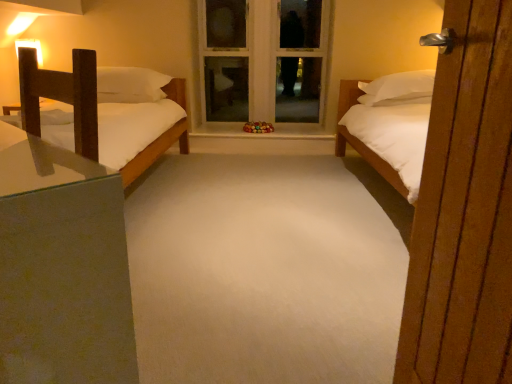
Question: From a real-world perspective, is wooden nightstand at left located beneath white painted wood window frame at center?

Choices:
 (A) no
 (B) yes

Answer: (B)

Question: Is the position of wooden nightstand at left more distant than that of white painted wood window frame at center?

Choices:
 (A) no
 (B) yes

Answer: (A)

Question: From the image's perspective, is wooden nightstand at left located above white painted wood window frame at center?

Choices:
 (A) yes
 (B) no

Answer: (B)

Question: Does wooden nightstand at left lie in front of white painted wood window frame at center?

Choices:
 (A) yes
 (B) no

Answer: (A)

Question: Is white painted wood window frame at center a part of wooden nightstand at left?

Choices:
 (A) yes
 (B) no

Answer: (B)

Question: From the image's perspective, is wooden nightstand at left positioned above or below wooden door at right?

Choices:
 (A) below
 (B) above

Answer: (B)

Question: Is wooden nightstand at left bigger or smaller than wooden door at right?

Choices:
 (A) big
 (B) small

Answer: (A)

Question: Is wooden nightstand at left taller or shorter than wooden door at right?

Choices:
 (A) short
 (B) tall

Answer: (A)

Question: Considering their positions, is wooden nightstand at left located in front of or behind wooden door at right?

Choices:
 (A) behind
 (B) front

Answer: (A)

Question: Based on their sizes in the image, would you say wooden nightstand at left is bigger or smaller than white soft carpet at center?

Choices:
 (A) small
 (B) big

Answer: (A)

Question: Relative to white soft carpet at center, is wooden nightstand at left in front or behind?

Choices:
 (A) behind
 (B) front

Answer: (B)

Question: Considering the positions of point (103, 266) and point (280, 324), is point (103, 266) closer or farther from the camera than point (280, 324)?

Choices:
 (A) closer
 (B) farther

Answer: (A)

Question: Choose the correct answer: Is wooden nightstand at left inside white soft carpet at center or outside it?

Choices:
 (A) inside
 (B) outside

Answer: (B)

Question: Is white painted wood window frame at center inside or outside of wooden nightstand at left?

Choices:
 (A) outside
 (B) inside

Answer: (A)

Question: From the image's perspective, is white painted wood window frame at center above or below wooden nightstand at left?

Choices:
 (A) below
 (B) above

Answer: (B)